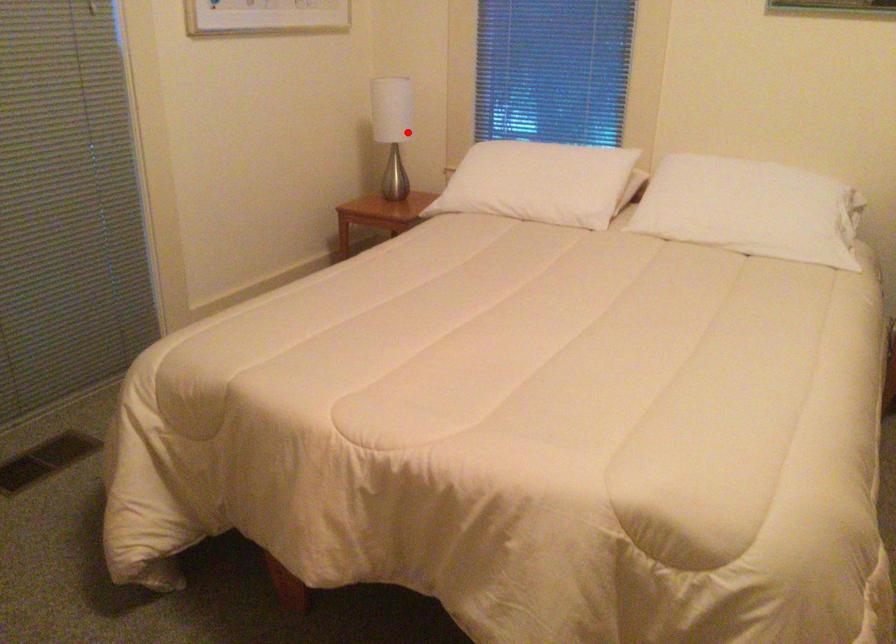
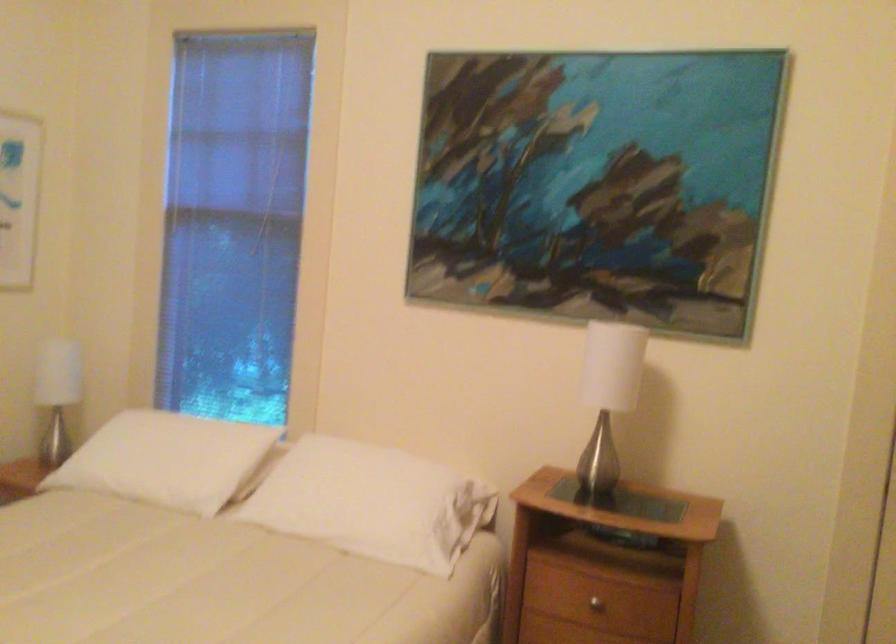
Find the pixel in the second image that matches the highlighted location in the first image.

(56, 393)